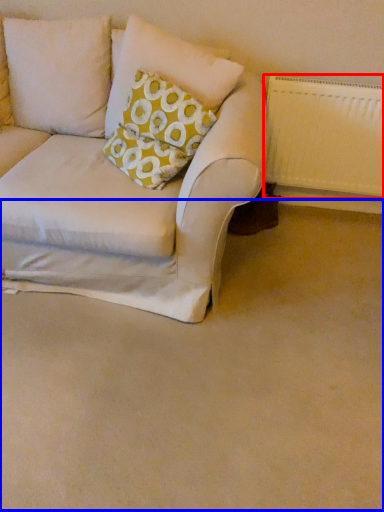
Question: Which point is closer to the camera, radiator (highlighted by a red box) or plain (highlighted by a blue box)?

Choices:
 (A) radiator
 (B) plain

Answer: (B)